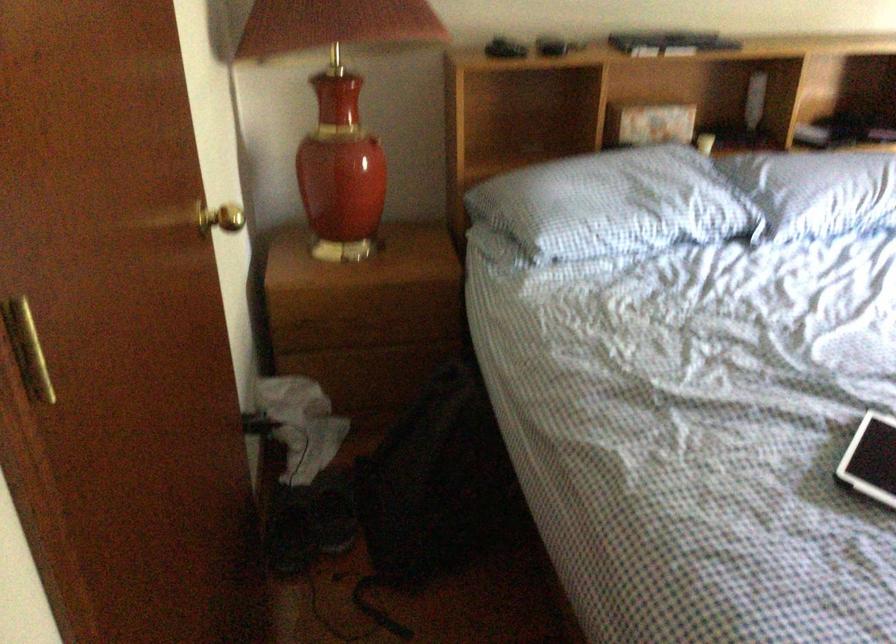
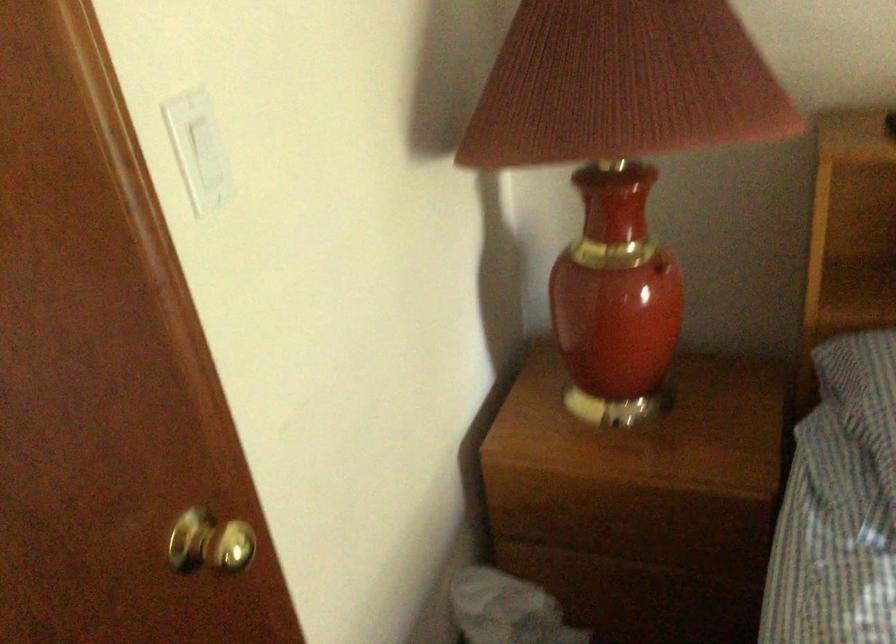
In the second image, find the point that corresponds to point 373,140 in the first image.

(661, 267)